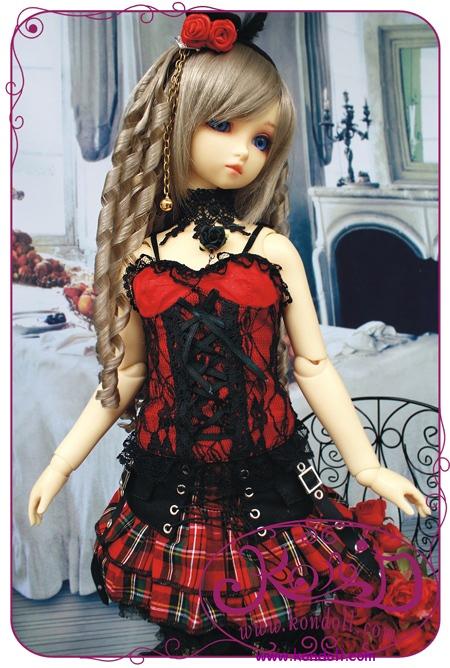
At what (x,y) coordinates should I click in order to perform the action: click on purple trim. Please return your answer as a coordinate pair (x, y). Looking at the image, I should click on (32, 23), (445, 488), (343, 658).